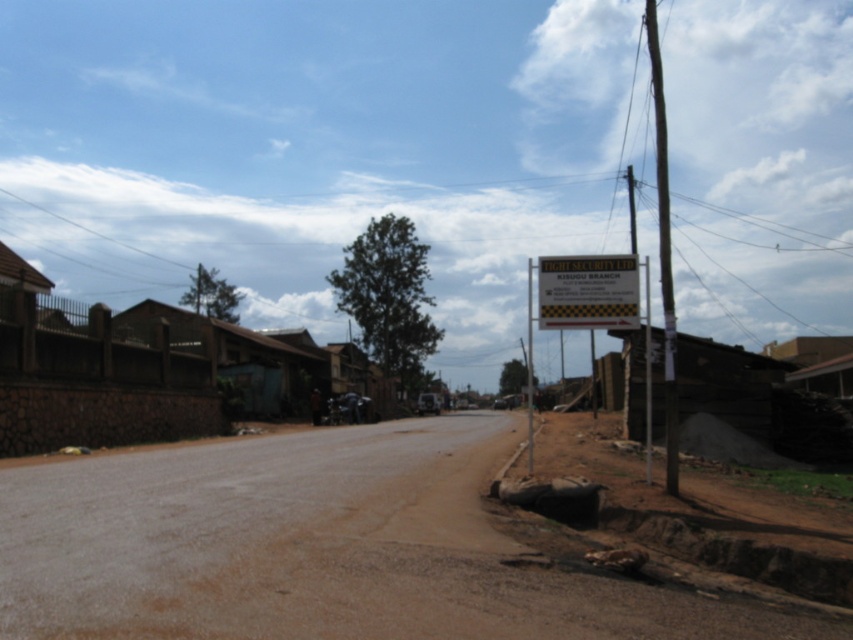
You are a delivery driver who needs to park your van near the metallic signboard at right and the smooth wood pole at right. The van is 2 meters wide. Is there enough space between the two objects to park safely?

The metallic signboard at right has a smaller size compared to smooth wood pole at right. However, the distance between them isn t specified in the objects description. Without knowing the gap between the two objects, it s impossible to determine if the van can park safely there. Please check the actual distance on site.

You are a delivery driver approaching the intersection near the metallic signboard at right and the smooth wood pole at right. You need to know which object is taller to plan your route. Can you tell me which one is taller?

The metallic signboard at right is shorter than the smooth wood pole at right, so the smooth wood pole at right is taller.